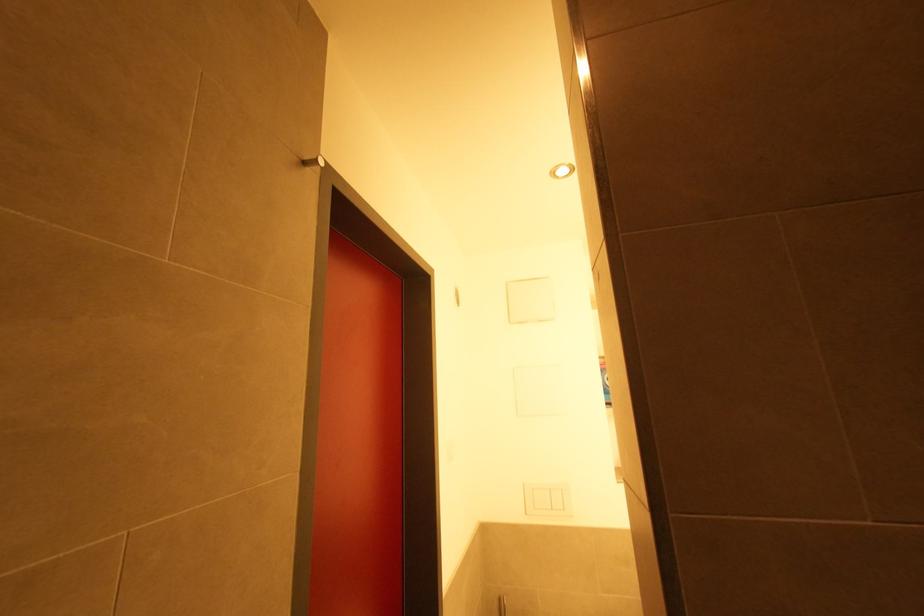
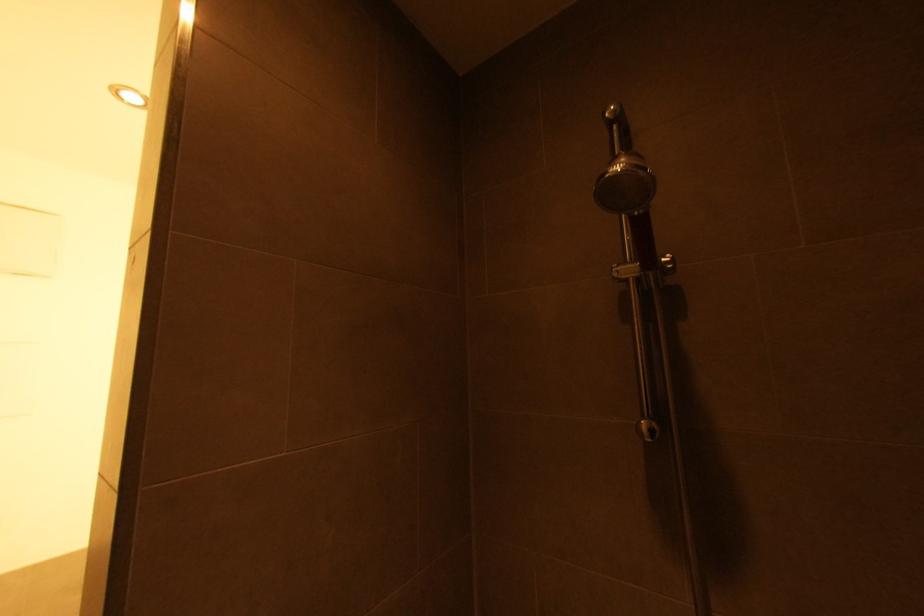
Question: How did the camera likely rotate?

Choices:
 (A) Left
 (B) Right
 (C) Up
 (D) Down

Answer: (B)